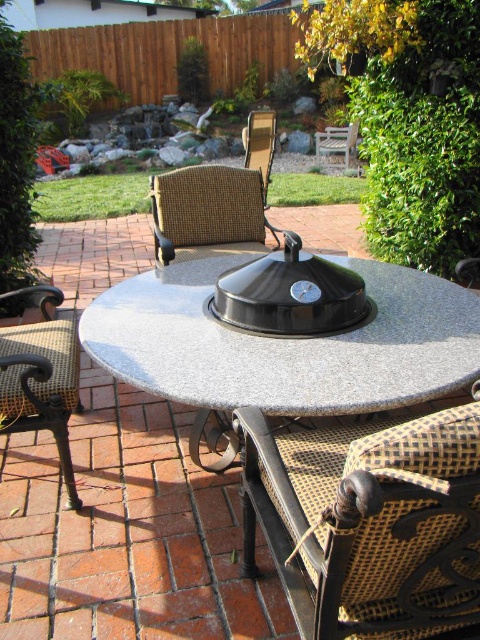
Can you confirm if woven fabric armchair at lower right is smaller than black wrought iron armchair at left?

Yes.

Consider the image. Who is taller, woven fabric armchair at lower right or black wrought iron armchair at left?

black wrought iron armchair at left

Where is `woven fabric armchair at lower right`? woven fabric armchair at lower right is located at coordinates (370, 522).

Can you confirm if woven fabric armchair at lower right is wider than woven fabric armchair at center?

No.

Which is in front, point (250, 513) or point (232, 250)?

Positioned in front is point (250, 513).

Between point (304, 586) and point (216, 196), which one is positioned in front?

Point (304, 586)

Identify the location of woven fabric armchair at lower right. (370, 522).

Can you confirm if granite table at center is positioned to the right of wooden armchair at center?

Incorrect, granite table at center is not on the right side of wooden armchair at center.

Does point (211, 323) come farther from viewer compared to point (340, 128)?

No, it is in front of (340, 128).

Locate an element on the screen. granite table at center is located at coordinates (285, 346).

The width and height of the screenshot is (480, 640). What are the coordinates of `granite table at center` in the screenshot? It's located at (285, 346).